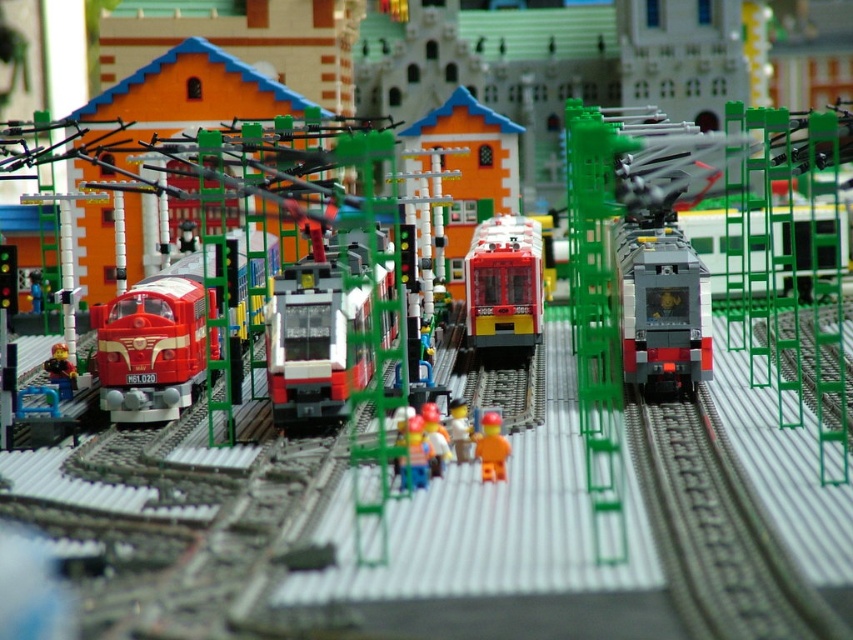
You are standing at the Lego train station and want to reach a specific point in the scene. The point you need to reach is located at coordinates point (354, 291). Based on the scene description, can you estimate how far this point is from your current position?

The point (354, 291) is 8.72 feet away from the viewer.

Consider the image. You are a Lego enthusiast who wants to display both the shiny red train at center and the matte red train at center on a shelf. Given that the shelf has limited space, which train would require more space due to its size?

The shiny red train at center is larger in size than the matte red train at center, so it would require more space on the shelf.